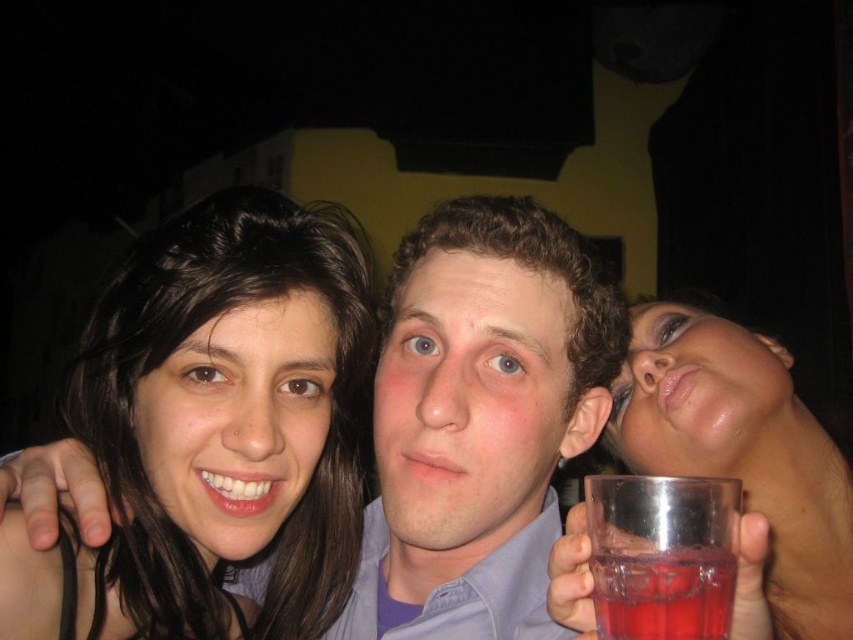
Does clear plastic glass at center appear on the left side of transparent glass at lower right?

Yes, clear plastic glass at center is to the left of transparent glass at lower right.

Which is more to the left, clear plastic glass at center or transparent glass at lower right?

clear plastic glass at center is more to the left.

Is point (524, 253) more distant than point (651, 620)?

Yes, it is.

You are a GUI agent. You are given a task and a screenshot of the screen. Output one action in this format:
    pyautogui.click(x=<x>, y=<y>)
    Task: Click on the clear plastic glass at center
    Image resolution: width=853 pixels, height=640 pixels.
    Given the screenshot: What is the action you would take?
    pyautogui.click(x=679, y=400)

Between clear plastic glass at center and transparent plastic glass at upper right, which one has more height?

With more height is clear plastic glass at center.

Between point (817, 513) and point (699, 424), which one is positioned in front?

Positioned in front is point (699, 424).

You are a GUI agent. You are given a task and a screenshot of the screen. Output one action in this format:
    pyautogui.click(x=<x>, y=<y>)
    Task: Click on the clear plastic glass at center
    
    Given the screenshot: What is the action you would take?
    pyautogui.click(x=679, y=400)

Between dark brown hair at upper left and transparent glass at lower right, which one appears on the left side from the viewer's perspective?

dark brown hair at upper left is more to the left.

Is dark brown hair at upper left positioned at the back of transparent glass at lower right?

Answer: Yes, it is behind transparent glass at lower right.

Locate an element on the screen. The image size is (853, 640). dark brown hair at upper left is located at coordinates (225, 420).